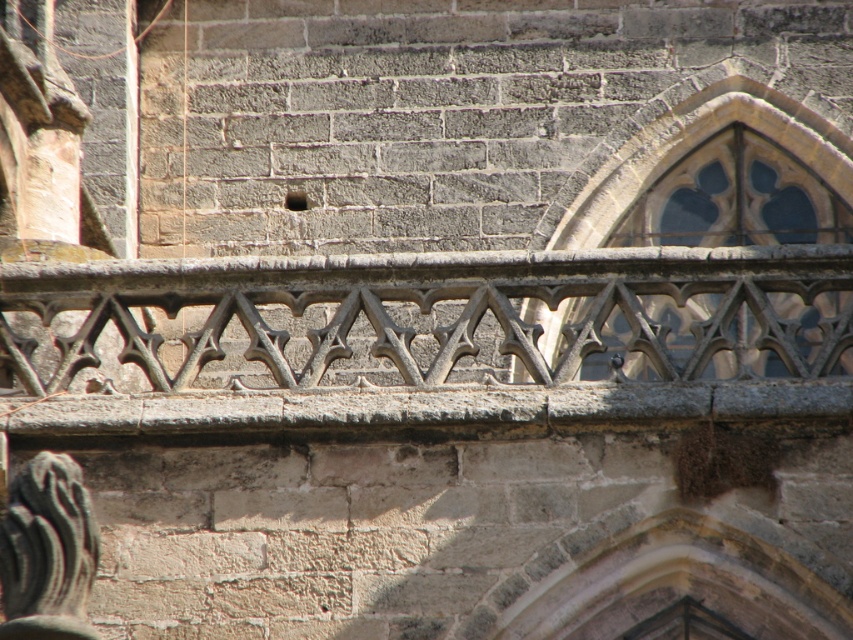
Question: In this image, where is gray stone railing at center located relative to stone stained glass window at upper right?

Choices:
 (A) left
 (B) right

Answer: (A)

Question: Observing the image, what is the correct spatial positioning of gray stone railing at center in reference to stone stained glass window at upper right?

Choices:
 (A) left
 (B) right

Answer: (A)

Question: Which point is closer to the camera?

Choices:
 (A) gray stone railing at center
 (B) stone stained glass window at upper right

Answer: (A)

Question: Which point is farther from the camera taking this photo?

Choices:
 (A) (769, 237)
 (B) (759, 326)

Answer: (A)

Question: From the image, what is the correct spatial relationship of gray stone railing at center in relation to stone stained glass window at upper right?

Choices:
 (A) left
 (B) right

Answer: (A)